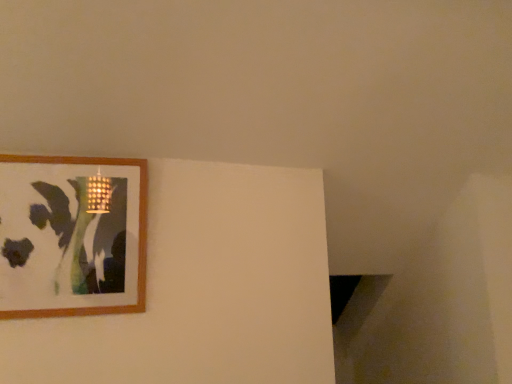
Question: Should I look upward or downward to see wooden picture frame at upper left?

Choices:
 (A) down
 (B) up

Answer: (A)